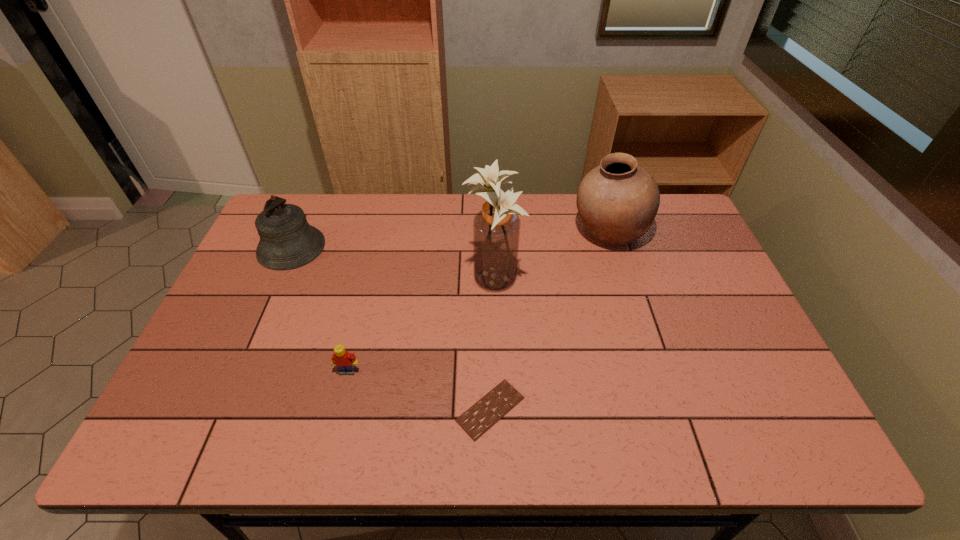
This screenshot has height=540, width=960. I want to click on empty location between the nearest object and the tallest object, so click(492, 344).

I want to click on free area in between the second object from left to right and the nearest object, so click(x=420, y=390).

Locate an element on the screen. This screenshot has width=960, height=540. free space between the rightmost object and the third tallest object is located at coordinates (450, 240).

Find the location of `free area in between the flower arrangement and the shortest object`. free area in between the flower arrangement and the shortest object is located at coordinates (492, 344).

Identify the location of free space between the second tallest object and the Lego. point(479,302).

Identify which object is the second nearest to the bell. Please provide its 2D coordinates. Your answer should be formatted as a tuple, i.e. [(x, y)], where the tuple contains the x and y coordinates of a point satisfying the conditions above.

[(496, 228)]

Choose which object is the third nearest neighbor to the bell. Please provide its 2D coordinates. Your answer should be formatted as a tuple, i.e. [(x, y)], where the tuple contains the x and y coordinates of a point satisfying the conditions above.

[(479, 418)]